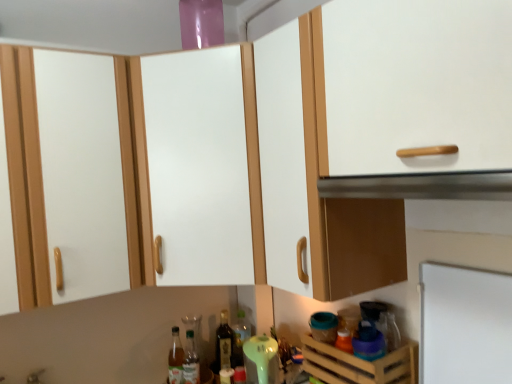
In order to face translucent glass bottle at center, acting as the third bottle starting from the left, should I rotate leftwards or rightwards?

To align with it, rotate left about 1.670°.

Describe the element at coordinates (240, 336) in the screenshot. I see `translucent glass bottle at center, acting as the third bottle starting from the left` at that location.

Where is `shiny dark glass bottle at center, which is the 2th bottle from left to right`? shiny dark glass bottle at center, which is the 2th bottle from left to right is located at coordinates (224, 343).

The width and height of the screenshot is (512, 384). What do you see at coordinates (199, 166) in the screenshot? I see `white matte cabinet at center` at bounding box center [199, 166].

Find the location of `translucent glass bottle at center, which is counted as the 1th bottle, starting from the right`. translucent glass bottle at center, which is counted as the 1th bottle, starting from the right is located at coordinates (240, 336).

Considering the positions of objects translucent glass bottle at center, which is counted as the 1th bottle, starting from the right, and wooden crate at lower right in the image provided, who is more to the right, translucent glass bottle at center, which is counted as the 1th bottle, starting from the right, or wooden crate at lower right?

From the viewer's perspective, wooden crate at lower right appears more on the right side.

Does translucent glass bottle at center, acting as the third bottle starting from the left, have a greater height compared to wooden crate at lower right?

Yes, translucent glass bottle at center, acting as the third bottle starting from the left, is taller than wooden crate at lower right.

From the image's perspective, does translucent glass bottle at center, acting as the third bottle starting from the left, appear lower than wooden crate at lower right?

Yes.

Is translucent glass bottle at center, acting as the third bottle starting from the left, not close to wooden crate at lower right?

No, translucent glass bottle at center, acting as the third bottle starting from the left, is in close proximity to wooden crate at lower right.

Is translucent glass bottle at center, acting as the third bottle starting from the left, taller than metallic silver vent at upper center?

Yes.

What's the angular difference between translucent glass bottle at center, which is counted as the 1th bottle, starting from the right, and metallic silver vent at upper center's facing directions?

They differ by 73.4 degrees in their facing directions.

From the image's perspective, would you say translucent glass bottle at center, acting as the third bottle starting from the left, is shown under metallic silver vent at upper center?

Indeed, from the image's perspective, translucent glass bottle at center, acting as the third bottle starting from the left, is shown beneath metallic silver vent at upper center.

In the image, is translucent glass bottle at center, acting as the third bottle starting from the left, on the left side or the right side of metallic silver vent at upper center?

Based on their positions, translucent glass bottle at center, acting as the third bottle starting from the left, is located to the left of metallic silver vent at upper center.

Which of these two, wooden crate at lower right or shiny dark glass bottle at center, which is the 2th bottle from left to right, is smaller?

shiny dark glass bottle at center, which is the 2th bottle from left to right.

Based on the photo, which object is wider, wooden crate at lower right or shiny dark glass bottle at center, which is the 2th bottle from left to right?

→ With larger width is wooden crate at lower right.

Would you say wooden crate at lower right is outside shiny dark glass bottle at center, which is the 2th bottle from left to right?

Yes, wooden crate at lower right is not within shiny dark glass bottle at center, which is the 2th bottle from left to right.

Are wooden crate at lower right and shiny dark glass bottle at center, which is the 2th bottle from left to right, located far from each other?

wooden crate at lower right is near shiny dark glass bottle at center, which is the 2th bottle from left to right, not far away.

Does point (144, 227) appear closer or farther from the camera than point (410, 344)?

Clearly, point (144, 227) is more distant from the camera than point (410, 344).

Can you confirm if white matte cabinet at center is thinner than wooden crate at lower right?

No, white matte cabinet at center is not thinner than wooden crate at lower right.

Which of these two, white matte cabinet at center or wooden crate at lower right, stands taller?

With more height is white matte cabinet at center.

Is white matte cabinet at center further to camera compared to wooden crate at lower right?

Yes, it is.

Between clear glass bottle at lower center, which is the 1th bottle from left to right, and white matte cabinet at center, which one has less height?

Standing shorter between the two is clear glass bottle at lower center, which is the 1th bottle from left to right.

How much distance is there between clear glass bottle at lower center, placed as the third bottle when sorted from right to left, and white matte cabinet at center?

clear glass bottle at lower center, placed as the third bottle when sorted from right to left, and white matte cabinet at center are 31.60 inches apart from each other.

Which of these two, clear glass bottle at lower center, which is the 1th bottle from left to right, or white matte cabinet at center, is bigger?

With larger size is white matte cabinet at center.

I want to click on bottle that is the 1st one when counting backward from the white matte cabinet at center, so click(191, 361).

From the image's perspective, which one is positioned lower, translucent glass bottle at center, acting as the third bottle starting from the left, or clear glass bottle at lower center, which is the 1th bottle from left to right?

clear glass bottle at lower center, which is the 1th bottle from left to right, appears lower in the image.

Between translucent glass bottle at center, which is counted as the 1th bottle, starting from the right, and clear glass bottle at lower center, placed as the third bottle when sorted from right to left, which one has less height?

With less height is clear glass bottle at lower center, placed as the third bottle when sorted from right to left.

Which of these two, translucent glass bottle at center, acting as the third bottle starting from the left, or clear glass bottle at lower center, which is the 1th bottle from left to right, is bigger?

Bigger between the two is translucent glass bottle at center, acting as the third bottle starting from the left.

From the image's perspective, is shiny dark glass bottle at center, placed as the second bottle when sorted from right to left, above or below clear glass bottle at lower center, placed as the third bottle when sorted from right to left?

shiny dark glass bottle at center, placed as the second bottle when sorted from right to left, is situated higher than clear glass bottle at lower center, placed as the third bottle when sorted from right to left, in the image.

Who is shorter, shiny dark glass bottle at center, placed as the second bottle when sorted from right to left, or clear glass bottle at lower center, which is the 1th bottle from left to right?

With less height is clear glass bottle at lower center, which is the 1th bottle from left to right.

Consider the image. Can you confirm if shiny dark glass bottle at center, placed as the second bottle when sorted from right to left, is thinner than clear glass bottle at lower center, placed as the third bottle when sorted from right to left?

Incorrect, the width of shiny dark glass bottle at center, placed as the second bottle when sorted from right to left, is not less than that of clear glass bottle at lower center, placed as the third bottle when sorted from right to left.

Which object is closer to the camera taking this photo, shiny dark glass bottle at center, placed as the second bottle when sorted from right to left, or clear glass bottle at lower center, which is the 1th bottle from left to right?

clear glass bottle at lower center, which is the 1th bottle from left to right.

Identify the location of bottle that is the 3rd one when counting backward from the wooden crate at lower right. This screenshot has height=384, width=512. (240, 336).

From the metallic silver vent at upper center, count the 1st bottle to the left and point to it. Please provide its 2D coordinates.

[(240, 336)]

Looking at the image, which one is located further to metallic silver vent at upper center, wooden crate at lower right or clear glass bottle at lower center, which is the 1th bottle from left to right?

clear glass bottle at lower center, which is the 1th bottle from left to right, is further to metallic silver vent at upper center.

Estimate the real-world distances between objects in this image. Which object is further from white matte cabinet at center, shiny dark glass bottle at center, which is the 2th bottle from left to right, or clear glass bottle at lower center, placed as the third bottle when sorted from right to left?

The object further to white matte cabinet at center is clear glass bottle at lower center, placed as the third bottle when sorted from right to left.

Considering their positions, is clear glass bottle at lower center, which is the 1th bottle from left to right, positioned further to metallic silver vent at upper center than white matte cabinet at center?

clear glass bottle at lower center, which is the 1th bottle from left to right.

From the image, which object appears to be farther from wooden crate at lower right, white matte cabinet at center or translucent glass bottle at center, which is counted as the 1th bottle, starting from the right?

white matte cabinet at center.

Estimate the real-world distances between objects in this image. Which object is further from shiny dark glass bottle at center, placed as the second bottle when sorted from right to left, translucent glass bottle at center, which is counted as the 1th bottle, starting from the right, or clear glass bottle at lower center, placed as the third bottle when sorted from right to left?

clear glass bottle at lower center, placed as the third bottle when sorted from right to left, is further to shiny dark glass bottle at center, placed as the second bottle when sorted from right to left.

When comparing their distances from metallic silver vent at upper center, does wooden crate at lower right or shiny dark glass bottle at center, which is the 2th bottle from left to right, seem further?

shiny dark glass bottle at center, which is the 2th bottle from left to right, lies further to metallic silver vent at upper center than the other object.

Which object lies further to the anchor point metallic silver vent at upper center, shiny dark glass bottle at center, placed as the second bottle when sorted from right to left, or wooden crate at lower right?

shiny dark glass bottle at center, placed as the second bottle when sorted from right to left, lies further to metallic silver vent at upper center than the other object.

Looking at the image, which one is located further to translucent glass bottle at center, which is counted as the 1th bottle, starting from the right, clear glass bottle at lower center, placed as the third bottle when sorted from right to left, or wooden crate at lower right?

wooden crate at lower right is positioned further to the anchor translucent glass bottle at center, which is counted as the 1th bottle, starting from the right.

This screenshot has height=384, width=512. Find the location of `drawer between white matte cabinet at center and clear glass bottle at lower center, which is the 1th bottle from left to right, vertically`. drawer between white matte cabinet at center and clear glass bottle at lower center, which is the 1th bottle from left to right, vertically is located at coordinates (359, 364).

This screenshot has width=512, height=384. What are the coordinates of `drawer between metallic silver vent at upper center and shiny dark glass bottle at center, which is the 2th bottle from left to right, along the z-axis` in the screenshot? It's located at (359, 364).

I want to click on drawer between metallic silver vent at upper center and translucent glass bottle at center, which is counted as the 1th bottle, starting from the right, in the front-back direction, so click(359, 364).

The height and width of the screenshot is (384, 512). In order to click on cabinetry between metallic silver vent at upper center and shiny dark glass bottle at center, which is the 2th bottle from left to right, along the z-axis in this screenshot , I will do `click(199, 166)`.